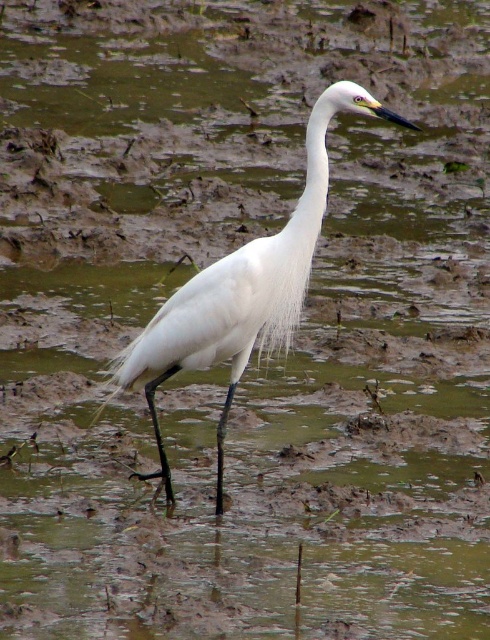
Question: Can you confirm if white feathered bird at center is positioned above white feathered neck at center?

Choices:
 (A) no
 (B) yes

Answer: (A)

Question: Among these objects, which one is farthest from the camera?

Choices:
 (A) white feathered bird at center
 (B) white feathered neck at center

Answer: (B)

Question: Does white feathered bird at center appear over white feathered neck at center?

Choices:
 (A) no
 (B) yes

Answer: (A)

Question: Where is white feathered bird at center located in relation to white feathered neck at center in the image?

Choices:
 (A) below
 (B) above

Answer: (A)